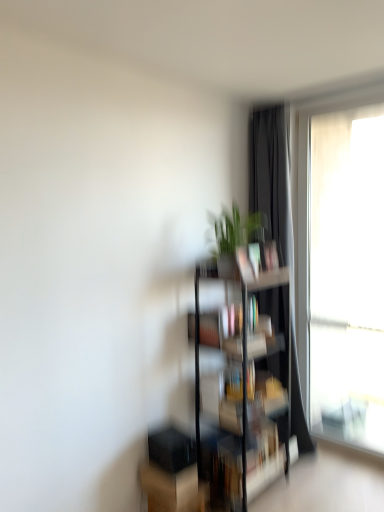
Question: Does translucent fabric at right have a greater width compared to clear glass bookshelf at center?

Choices:
 (A) yes
 (B) no

Answer: (B)

Question: Considering the relative sizes of translucent fabric at right and clear glass bookshelf at center in the image provided, is translucent fabric at right shorter than clear glass bookshelf at center?

Choices:
 (A) yes
 (B) no

Answer: (B)

Question: Is translucent fabric at right taller than clear glass bookshelf at center?

Choices:
 (A) yes
 (B) no

Answer: (A)

Question: Can you confirm if translucent fabric at right is positioned to the right of clear glass bookshelf at center?

Choices:
 (A) no
 (B) yes

Answer: (B)

Question: Is translucent fabric at right beside clear glass bookshelf at center?

Choices:
 (A) yes
 (B) no

Answer: (B)

Question: Do you think matte black bookshelf at center is within translucent fabric at right, or outside of it?

Choices:
 (A) inside
 (B) outside

Answer: (B)

Question: Is matte black bookshelf at center in front of or behind translucent fabric at right in the image?

Choices:
 (A) behind
 (B) front

Answer: (B)

Question: Considering the positions of matte black bookshelf at center and translucent fabric at right in the image, is matte black bookshelf at center taller or shorter than translucent fabric at right?

Choices:
 (A) tall
 (B) short

Answer: (B)

Question: Considering the relative positions of matte black bookshelf at center and translucent fabric at right in the image provided, is matte black bookshelf at center to the left or to the right of translucent fabric at right?

Choices:
 (A) right
 (B) left

Answer: (B)

Question: Looking at their shapes, would you say clear glass bookshelf at center is wider or thinner than green matte plant at center?

Choices:
 (A) thin
 (B) wide

Answer: (B)

Question: Relative to green matte plant at center, is clear glass bookshelf at center in front or behind?

Choices:
 (A) front
 (B) behind

Answer: (B)

Question: Based on their sizes in the image, would you say clear glass bookshelf at center is bigger or smaller than green matte plant at center?

Choices:
 (A) small
 (B) big

Answer: (B)

Question: From their relative heights in the image, would you say clear glass bookshelf at center is taller or shorter than green matte plant at center?

Choices:
 (A) short
 (B) tall

Answer: (B)

Question: From the image's perspective, is translucent fabric at right located above or below black matte curtain at right?

Choices:
 (A) above
 (B) below

Answer: (A)

Question: Is translucent fabric at right bigger or smaller than black matte curtain at right?

Choices:
 (A) big
 (B) small

Answer: (B)